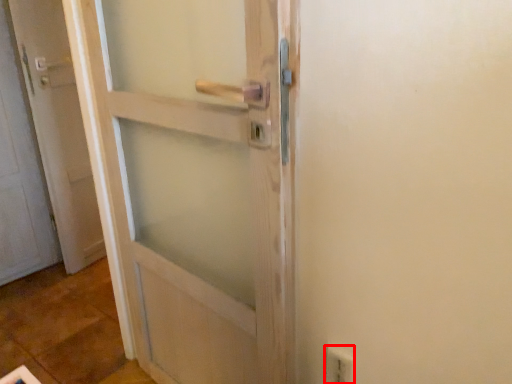
Question: From the image, what is the correct spatial relationship of electric outlet (annotated by the red box) in relation to door?

Choices:
 (A) left
 (B) right

Answer: (B)